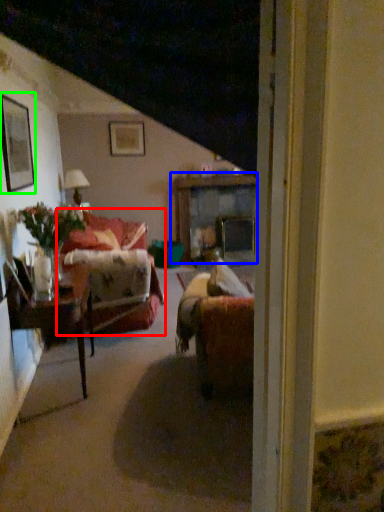
Question: Which is nearer to the studio couch (highlighted by a red box)? table (highlighted by a blue box) or picture frame (highlighted by a green box).

Choices:
 (A) table
 (B) picture frame

Answer: (B)